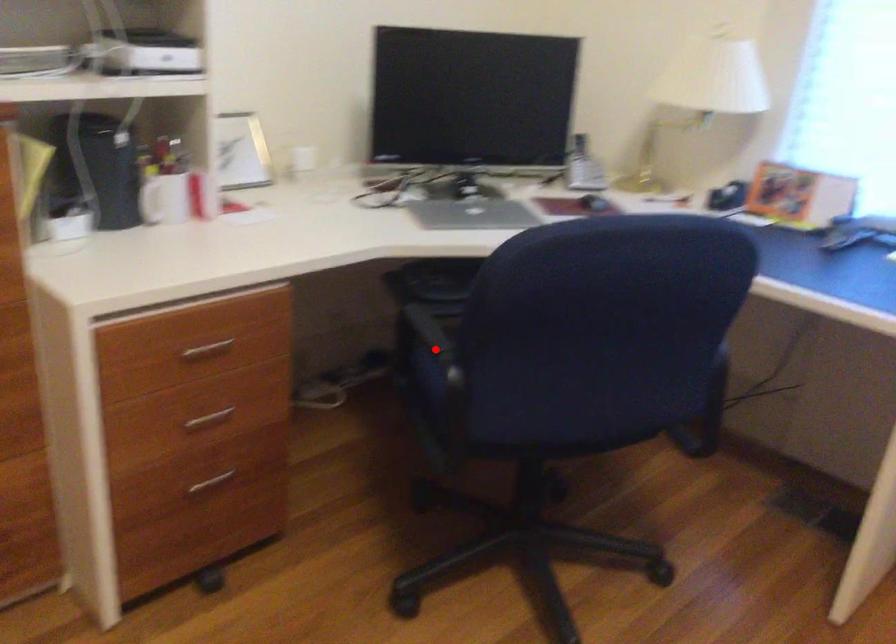
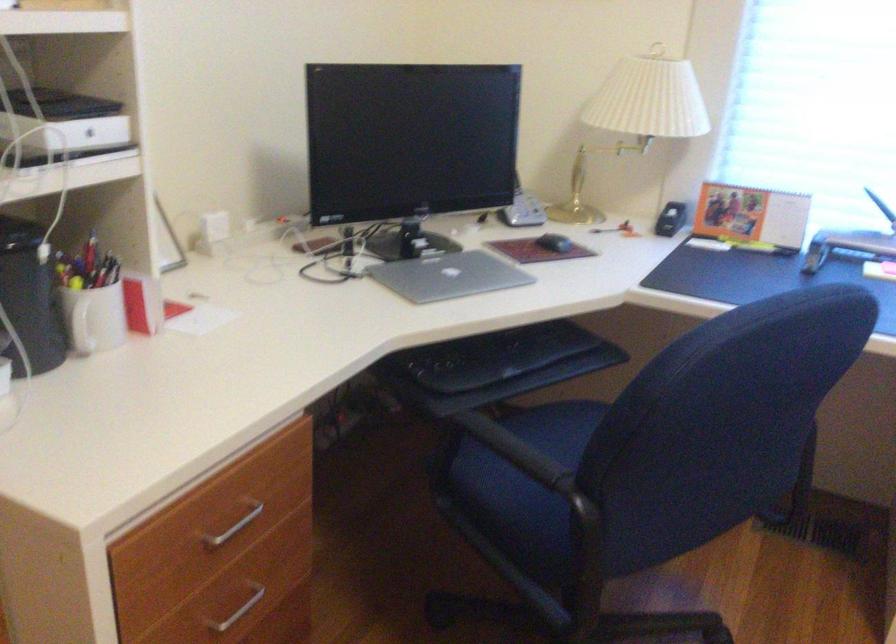
Where in the second image is the point corresponding to the highlighted location from the first image?

(524, 462)